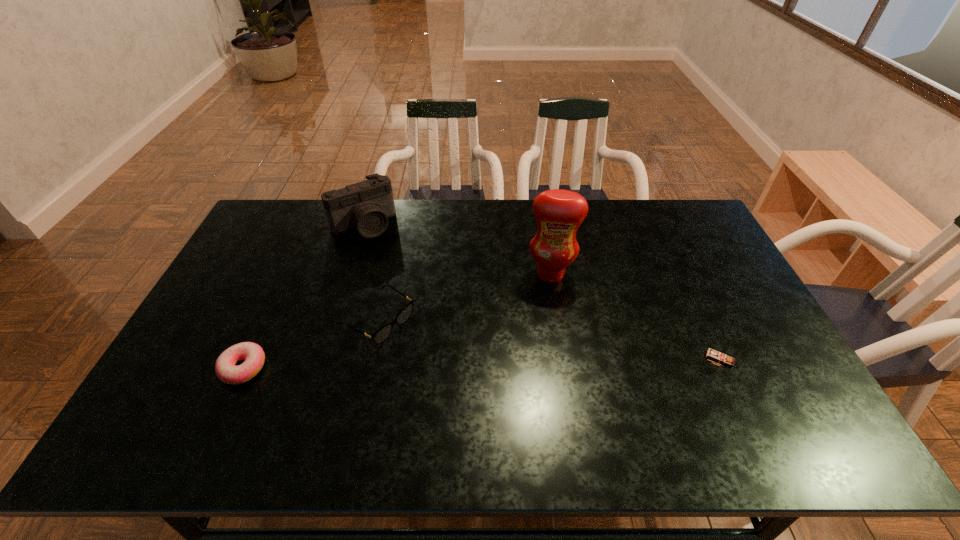
Locate an element on the screen. This screenshot has height=540, width=960. vacant area located on the left of the third shortest object is located at coordinates (655, 359).

Find the location of a particular element. The width and height of the screenshot is (960, 540). free region located on the front-facing side of the spectacles is located at coordinates (468, 375).

This screenshot has width=960, height=540. In order to click on vacant area located on the front-facing side of the spectacles in this screenshot , I will do `click(493, 391)`.

You are a GUI agent. You are given a task and a screenshot of the screen. Output one action in this format:
    pyautogui.click(x=<x>, y=<y>)
    Task: Click on the free spot located on the front-facing side of the spectacles
    
    Given the screenshot: What is the action you would take?
    pyautogui.click(x=487, y=387)

Where is `free region located on the label side of the condiment`? The height and width of the screenshot is (540, 960). free region located on the label side of the condiment is located at coordinates (543, 330).

This screenshot has height=540, width=960. What are the coordinates of `free space located 0.310m on the label side of the condiment` in the screenshot? It's located at (540, 366).

You are a GUI agent. You are given a task and a screenshot of the screen. Output one action in this format:
    pyautogui.click(x=<x>, y=<y>)
    Task: Click on the free space located on the label side of the condiment
    Image resolution: width=960 pixels, height=540 pixels.
    Given the screenshot: What is the action you would take?
    pyautogui.click(x=540, y=375)

Locate an element on the screen. The image size is (960, 540). vacant space located 0.100m at the lens of the farthest object is located at coordinates [386, 256].

At what (x,y) coordinates should I click in order to perform the action: click on free location located 0.080m at the lens of the farthest object. Please return your answer as a coordinate pair (x, y). Image resolution: width=960 pixels, height=540 pixels. Looking at the image, I should click on (384, 253).

Image resolution: width=960 pixels, height=540 pixels. I want to click on blank space located 0.390m at the lens of the farthest object, so click(424, 312).